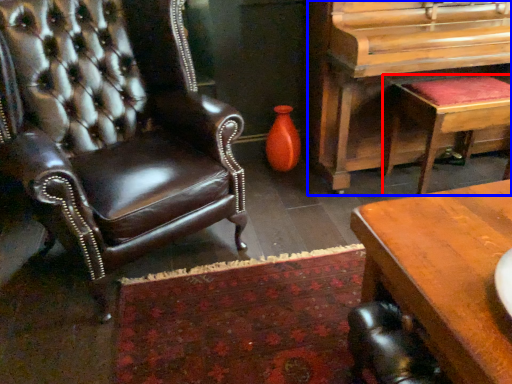
Question: Which object is further to the camera taking this photo, stool (highlighted by a red box) or piano (highlighted by a blue box)?

Choices:
 (A) stool
 (B) piano

Answer: (A)